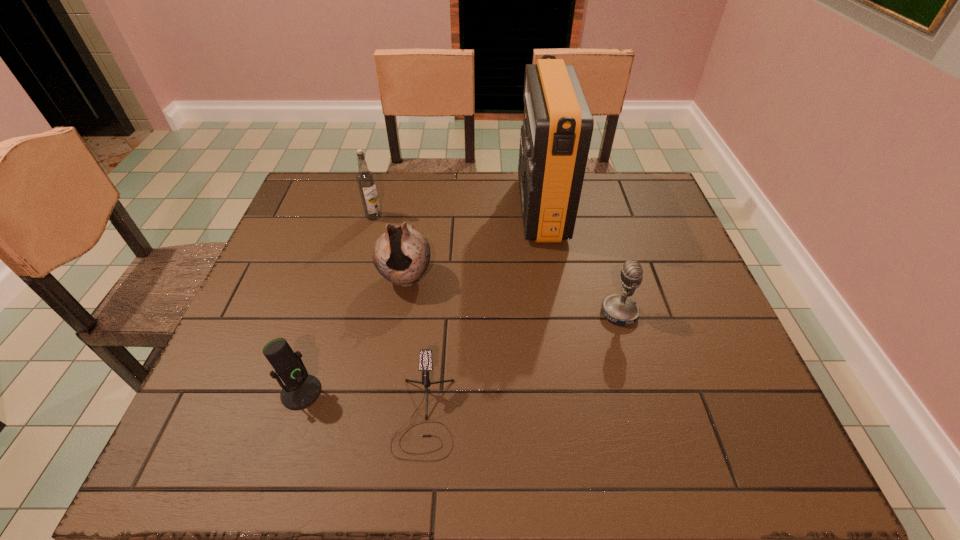
At what (x,y) coordinates should I click in order to perform the action: click on blank region between the leftmost microphone and the tallest object. Please return your answer as a coordinate pair (x, y). Looking at the image, I should click on (421, 300).

Locate an element on the screen. free space between the third nearest object and the vodka is located at coordinates (496, 265).

The width and height of the screenshot is (960, 540). Identify the location of empty location between the vodka and the second microphone from left to right. (399, 316).

Locate an element on the screen. free spot between the radio receiver and the pottery is located at coordinates (473, 244).

This screenshot has width=960, height=540. In order to click on free space between the pottery and the farthest microphone in this screenshot , I will do `click(513, 295)`.

I want to click on free spot between the radio receiver and the fourth nearest object, so click(473, 244).

Find the location of a particular element. free space between the second microphone from right to left and the fourth farthest object is located at coordinates (522, 364).

Locate an element on the screen. This screenshot has height=540, width=960. free space between the pottery and the leftmost microphone is located at coordinates (353, 335).

Identify the location of object that is the fifth closest to the vodka. (619, 309).

At what (x,y) coordinates should I click in order to perform the action: click on the second closest object to the shortest microphone. Please return your answer as a coordinate pair (x, y). This screenshot has width=960, height=540. Looking at the image, I should click on (401, 255).